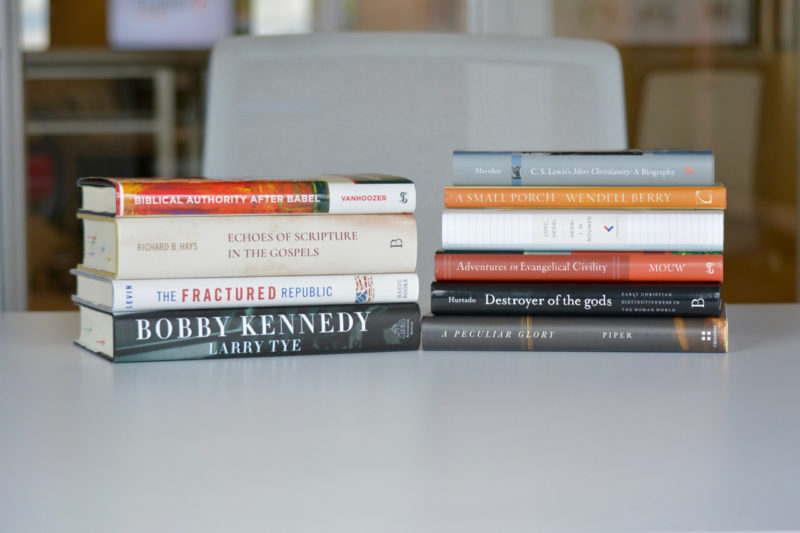
Image resolution: width=800 pixels, height=533 pixels. What are the coordinates of `books` in the screenshot? It's located at (256, 343), (270, 289), (266, 253), (284, 201), (538, 163), (540, 191), (534, 227), (524, 271), (508, 300), (508, 336).